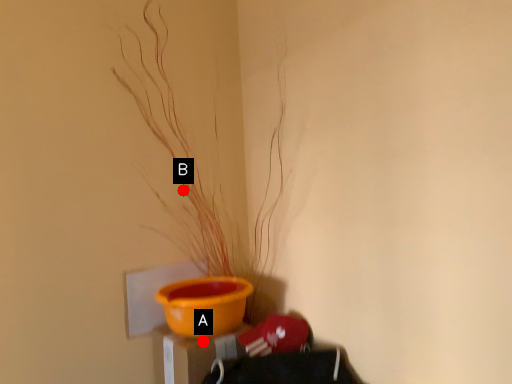
Question: Two points are circled on the image, labeled by A and B beside each circle. Which point is farther from the camera taking this photo?

Choices:
 (A) A is further
 (B) B is further

Answer: (B)